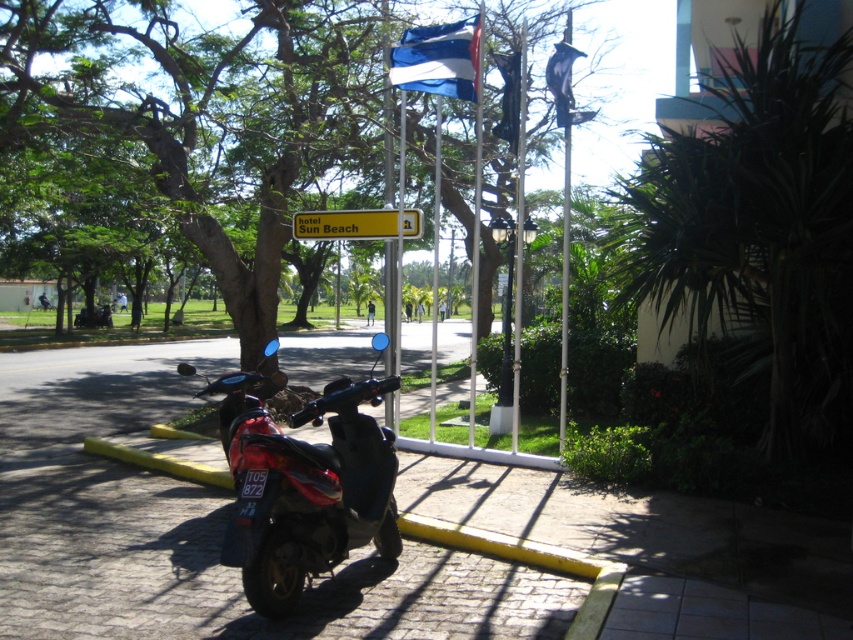
You are a delivery person with a package for the hotel. You need to place the package on the ground between the green leafy tree at upper right and the yellow plastic sign at center. Can you fit the package there?

The distance between the green leafy tree at upper right and the yellow plastic sign at center is 3.70 meters, so yes, the package can be placed there as there is enough space.

You are a photographer planning to take a wide shot of the hotel entrance. You need to ensure that the green leafy tree at upper right and the blue and white fabric flag at upper center are both visible in the frame. Given their sizes, which object will occupy more space in the photo?

The green leafy tree at upper right will occupy more space in the photo because its width surpasses that of the blue and white fabric flag at upper center.